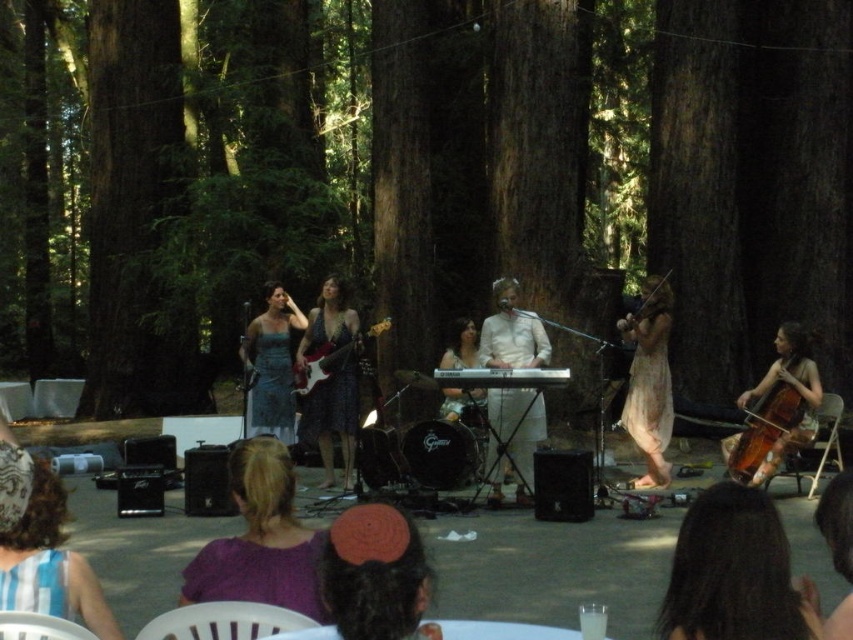
Question: Which point appears closest to the camera in this image?

Choices:
 (A) (801, 369)
 (B) (635, 317)

Answer: (A)

Question: Which object appears closest to the camera in this image?

Choices:
 (A) dark brown hair at lower right
 (B) light beige fabric dress at center

Answer: (A)

Question: Can you confirm if matte blue dress at center is wider than brown wooden cello at lower right?

Choices:
 (A) no
 (B) yes

Answer: (A)

Question: Does matte black guitar at center appear on the right side of black plastic keyboard at center?

Choices:
 (A) no
 (B) yes

Answer: (A)

Question: Among these points, which one is farthest from the camera?

Choices:
 (A) (654, 291)
 (B) (543, 420)

Answer: (A)

Question: Is brown wood tree at center below white matte keyboard at center?

Choices:
 (A) no
 (B) yes

Answer: (A)